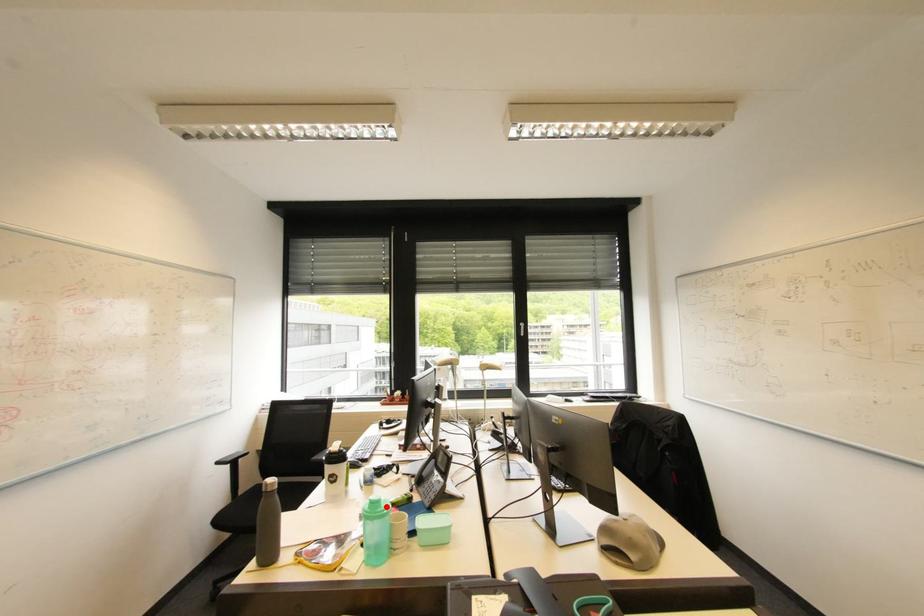
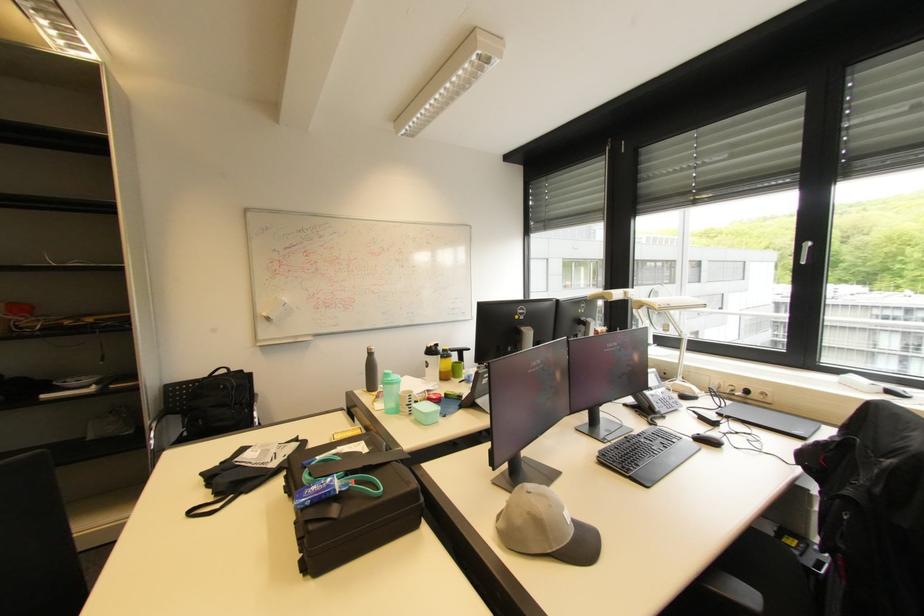
Find the pixel in the second image that matches the highlighted location in the first image.

(394, 379)